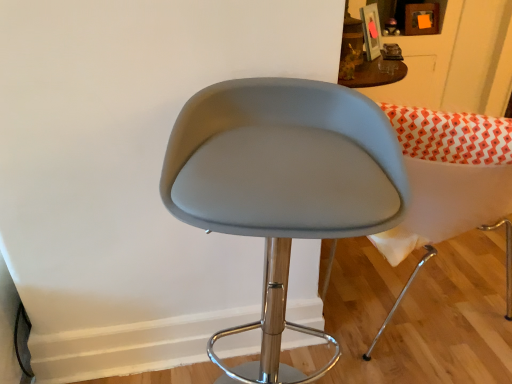
Locate an element on the screen. The width and height of the screenshot is (512, 384). satin gray stool at center is located at coordinates (282, 178).

The height and width of the screenshot is (384, 512). What do you see at coordinates (282, 178) in the screenshot? I see `satin gray stool at center` at bounding box center [282, 178].

Identify the location of satin gray stool at center. Image resolution: width=512 pixels, height=384 pixels. (282, 178).